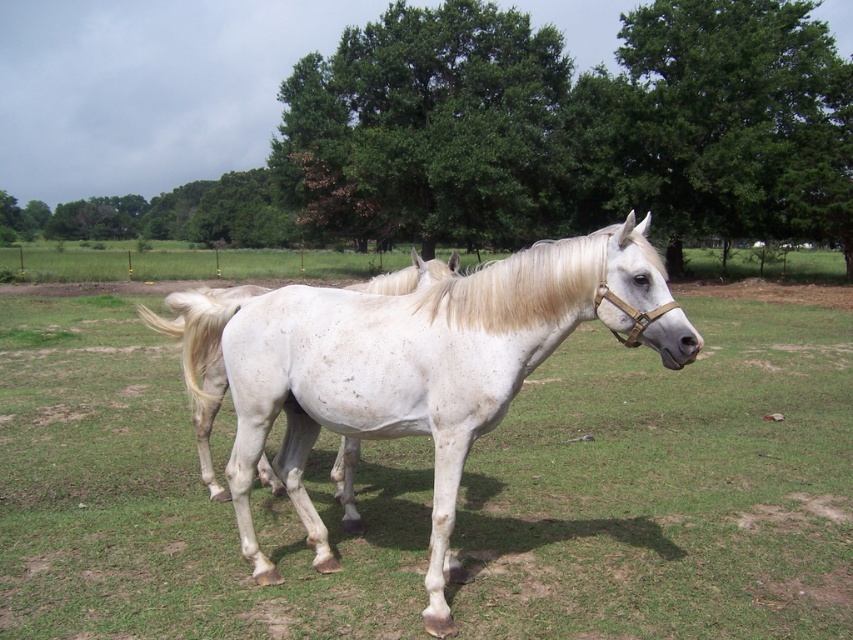
Is green leafy tree at upper center behind white silky mane at center?

Yes, green leafy tree at upper center is further from the viewer.

Which is behind, point (671, 173) or point (436, 276)?

Point (671, 173)

Locate an element on the screen. The image size is (853, 640). green leafy tree at upper center is located at coordinates (740, 118).

Consider the image. Does green leafy tree at upper center come in front of blonde silky mane at center?

No.

Which is in front, point (785, 224) or point (641, 237)?

Point (641, 237)

Describe the element at coordinates (740, 118) in the screenshot. I see `green leafy tree at upper center` at that location.

Find the location of a particular element. The image size is (853, 640). green leafy tree at upper center is located at coordinates (740, 118).

Consider the image. Is green leafy tree at center to the right of green leafy tree at upper center from the viewer's perspective?

No, green leafy tree at center is not to the right of green leafy tree at upper center.

Does green leafy tree at center appear under green leafy tree at upper center?

Indeed, green leafy tree at center is positioned under green leafy tree at upper center.

Locate an element on the screen. This screenshot has height=640, width=853. green leafy tree at center is located at coordinates (424, 125).

What are the coordinates of `green leafy tree at center` in the screenshot? It's located at (424, 125).